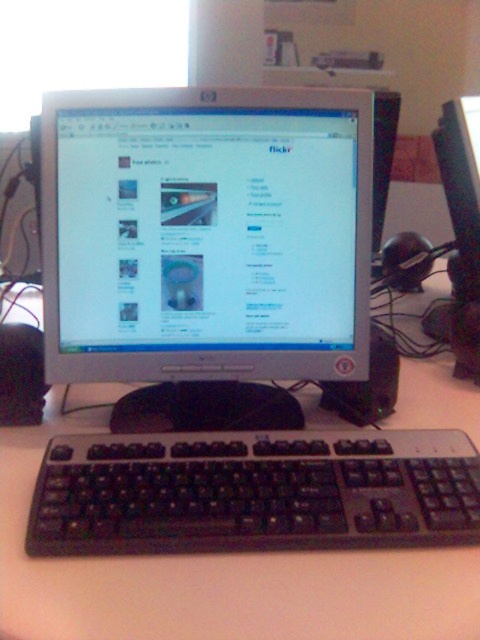
Question: Is black plastic keyboard at lower center smaller than white plastic computer desk at center?

Choices:
 (A) yes
 (B) no

Answer: (A)

Question: Which point is farther from the camera taking this photo?

Choices:
 (A) (74, 390)
 (B) (202, 99)

Answer: (A)

Question: Estimate the real-world distances between objects in this image. Which object is closer to the white plastic computer desk at center?

Choices:
 (A) black plastic keyboard at lower center
 (B) silver metallic monitor at center

Answer: (A)

Question: Can you confirm if silver metallic monitor at center is thinner than white plastic computer desk at center?

Choices:
 (A) no
 (B) yes

Answer: (B)

Question: Is black plastic keyboard at lower center smaller than white plastic computer desk at center?

Choices:
 (A) no
 (B) yes

Answer: (B)

Question: Which object is farther from the camera taking this photo?

Choices:
 (A) silver metallic monitor at center
 (B) black plastic keyboard at lower center

Answer: (A)